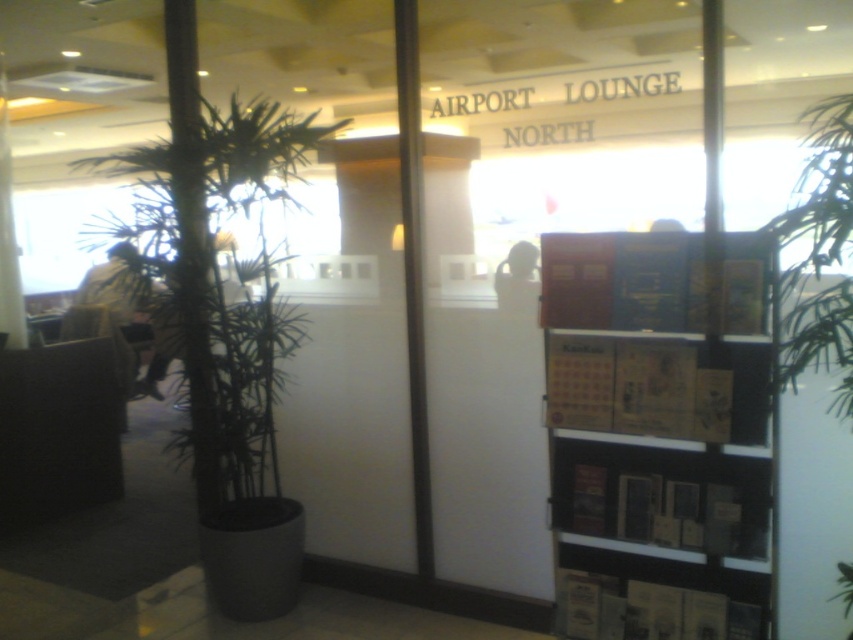
Question: Which object is positioned closest to the green leafy plant at left?

Choices:
 (A) green bamboo at left
 (B) wooden bookshelf at right

Answer: (A)

Question: Estimate the real-world distances between objects in this image. Which object is farther from the green bamboo at left?

Choices:
 (A) green leafy plant at left
 (B) wooden bookshelf at right
 (C) green leafy plant at center

Answer: (C)

Question: Is green leafy plant at center thinner than green bamboo at left?

Choices:
 (A) yes
 (B) no

Answer: (B)

Question: Is green leafy plant at left bigger than green bamboo at left?

Choices:
 (A) no
 (B) yes

Answer: (B)

Question: Can you confirm if wooden bookshelf at right is positioned below green bamboo at left?

Choices:
 (A) yes
 (B) no

Answer: (A)

Question: Which of the following is the farthest from the observer?

Choices:
 (A) wooden bookshelf at right
 (B) green leafy plant at center
 (C) green bamboo at left

Answer: (C)